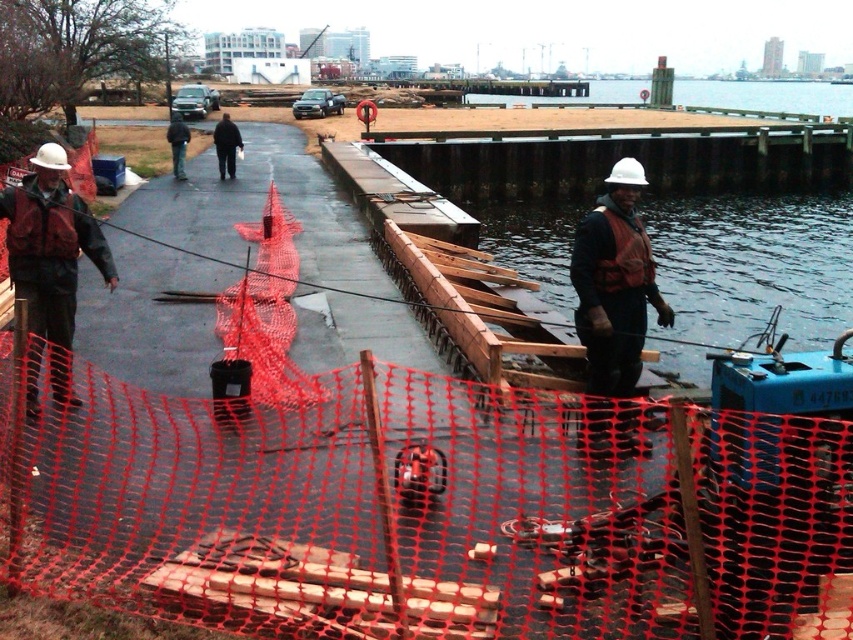
You are a safety inspector arriving at the construction site. You see the white hard hat at center and the matte black jacket at left. Which object is positioned lower in the image?

The white hard hat at center is located below the matte black jacket at left, so it is positioned lower in the image.

What object is located at the coordinates point (614,284) in the image?

The white hard hat at center is located at point (614,284).